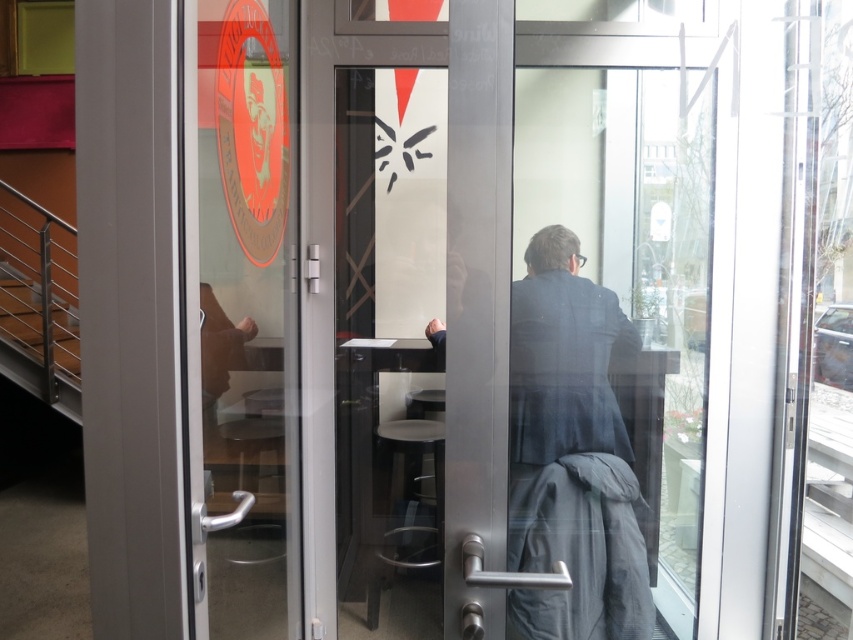
Question: In this image, where is transparent glass door at left located relative to gray woolen robe at center?

Choices:
 (A) below
 (B) above

Answer: (B)

Question: Which point is closer to the camera?

Choices:
 (A) gray woolen robe at center
 (B) transparent glass door at left

Answer: (B)

Question: Can you confirm if transparent glass door at left is thinner than gray woolen robe at center?

Choices:
 (A) yes
 (B) no

Answer: (A)

Question: Can you confirm if transparent glass door at left is positioned to the left of gray woolen robe at center?

Choices:
 (A) no
 (B) yes

Answer: (B)

Question: Which of the following is the farthest from the observer?

Choices:
 (A) gray woolen robe at center
 (B) transparent glass door at left

Answer: (A)